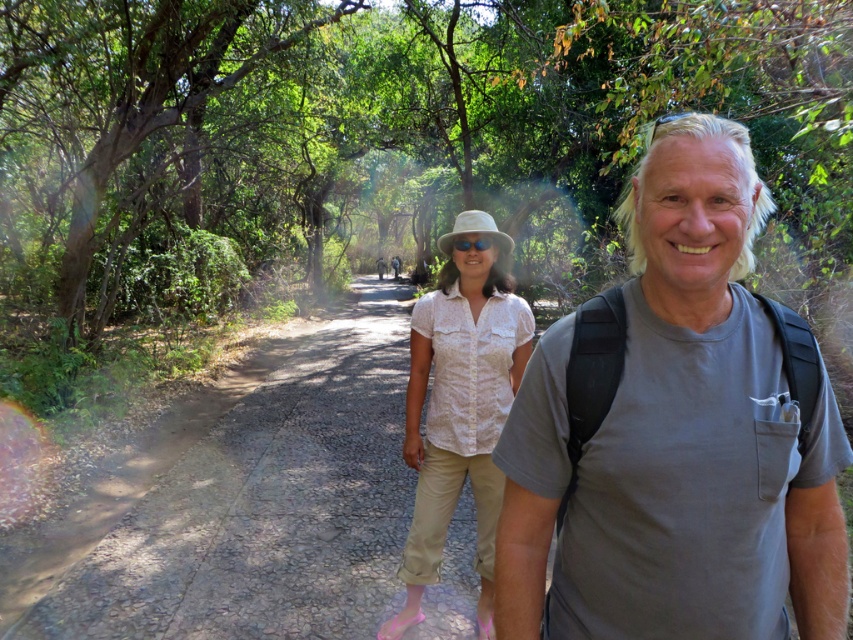
Between green leafy tree at center and gray cotton t-shirt at center, which one is positioned lower?

Positioned lower is gray cotton t-shirt at center.

Which of these two, green leafy tree at center or gray cotton t-shirt at center, stands taller?

green leafy tree at center

Who is more forward, (339, 172) or (585, 484)?

Point (585, 484) is in front.

Where is `green leafy tree at center`? Image resolution: width=853 pixels, height=640 pixels. green leafy tree at center is located at coordinates (381, 122).

Is point (842, 129) closer to camera compared to point (399, 352)?

Yes, it is in front of point (399, 352).

Who is lower down, green leafy tree at center or dirt road at center?

Positioned lower is dirt road at center.

Measure the distance between point (299,61) and camera.

Point (299,61) is 51.72 feet away from camera.

Locate an element on the screen. Image resolution: width=853 pixels, height=640 pixels. green leafy tree at center is located at coordinates click(381, 122).

Is gray cotton t-shirt at center above dirt road at center?

Yes, gray cotton t-shirt at center is above dirt road at center.

Where is `gray cotton t-shirt at center`? gray cotton t-shirt at center is located at coordinates (699, 429).